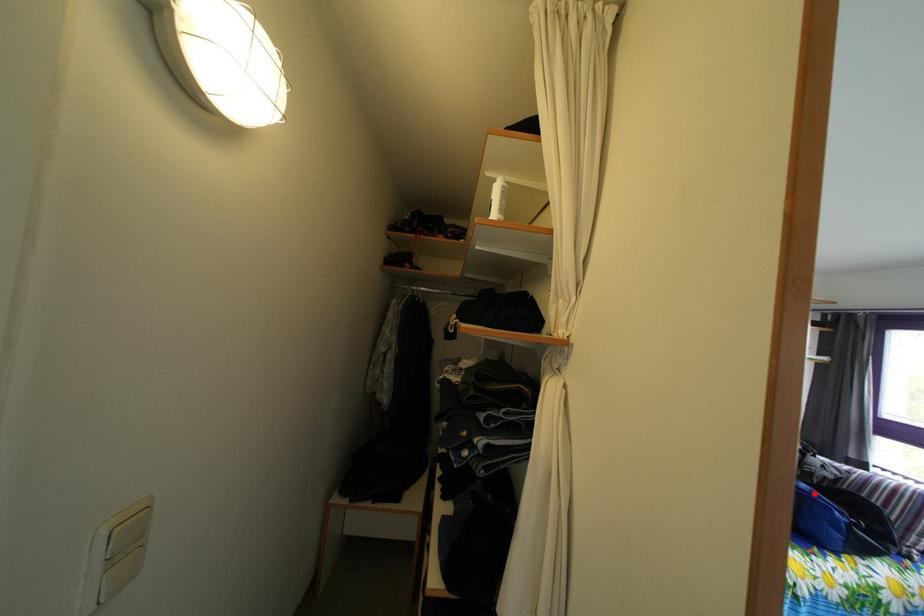
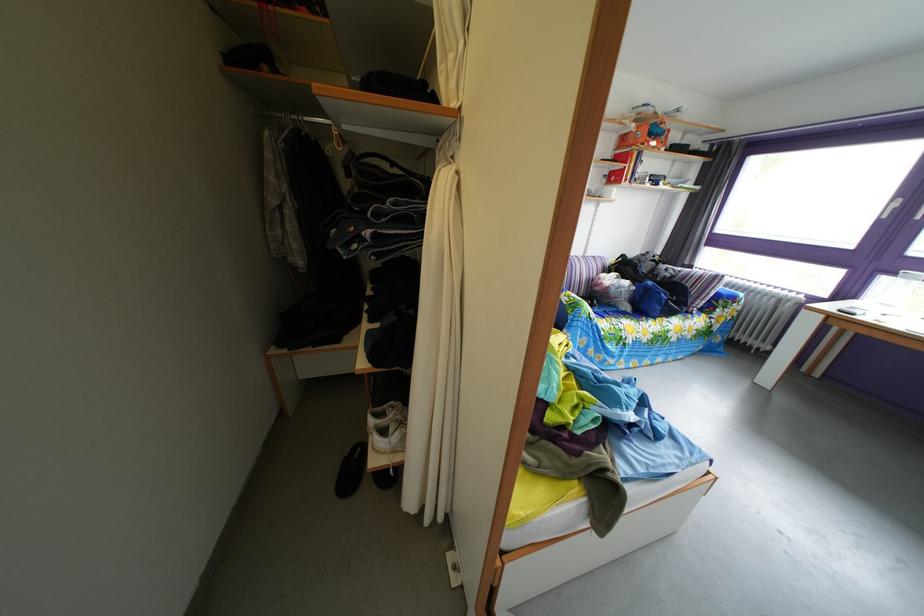
Locate, in the second image, the point that corresponds to the highlighted location in the first image.

(661, 291)